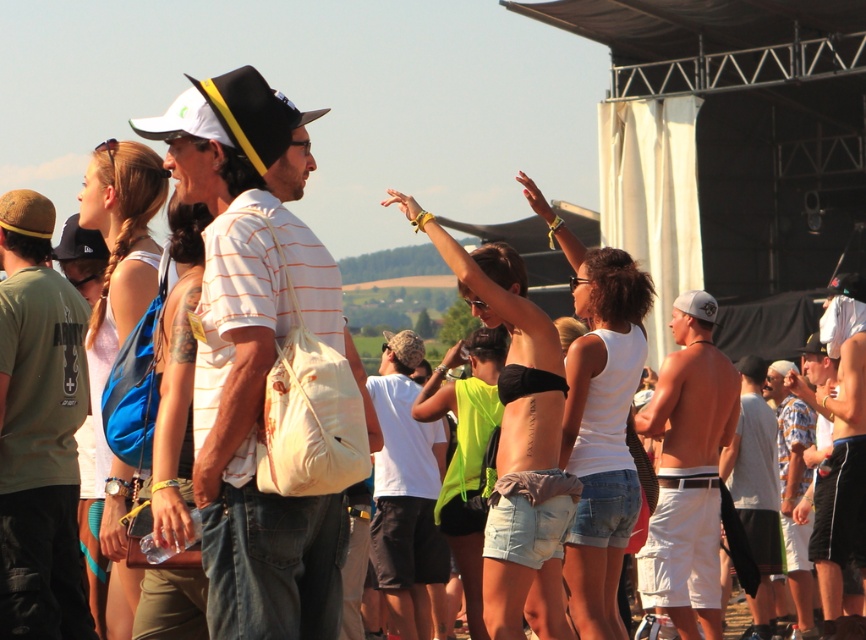
Who is more forward, (695, 608) or (832, 454)?

Point (695, 608) is in front.

In the scene shown: Is white cotton shorts at right further to camera compared to shiny silver tank top at center?

No, white cotton shorts at right is in front of shiny silver tank top at center.

Is point (675, 314) positioned in front of point (844, 365)?

Yes, point (675, 314) is in front of point (844, 365).

At what (x,y) coordinates should I click in order to perform the action: click on white cotton shorts at right. Please return your answer as a coordinate pair (x, y). Looking at the image, I should click on (688, 468).

Which is in front, point (249, 148) or point (824, 518)?

Positioned in front is point (249, 148).

Which of these two, white canvas bag at center or shiny silver tank top at center, stands taller?

With more height is white canvas bag at center.

Is point (192, 104) positioned after point (864, 422)?

That is False.

Find the location of a particular element. Image resolution: width=866 pixels, height=640 pixels. white canvas bag at center is located at coordinates (254, 371).

Is white cotton shorts at right above white cotton t-shirt at center?

Actually, white cotton shorts at right is below white cotton t-shirt at center.

Measure the distance between white cotton shorts at right and white cotton t-shirt at center.

white cotton shorts at right and white cotton t-shirt at center are 6.52 meters apart.

Describe the element at coordinates (688, 468) in the screenshot. Image resolution: width=866 pixels, height=640 pixels. I see `white cotton shorts at right` at that location.

Find the location of a particular element. white cotton shorts at right is located at coordinates (688, 468).